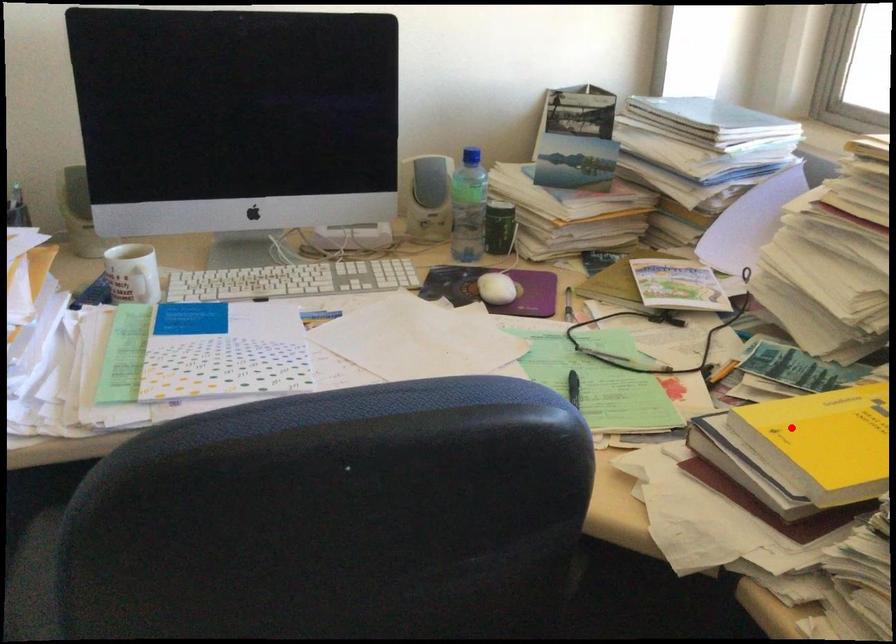
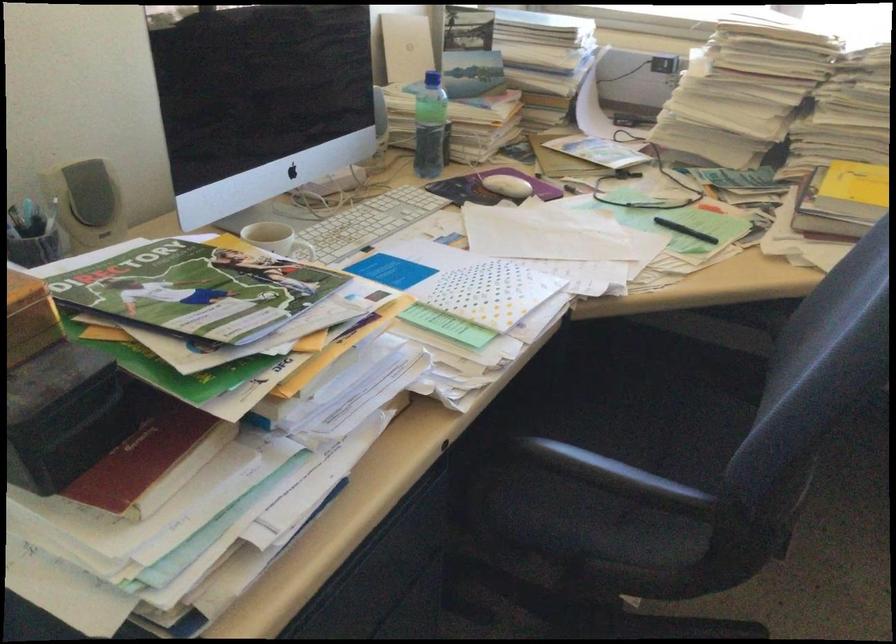
Question: I am providing you with two images of the same scene from different viewpoints. Given a red point in image1, look at the same physical point in image2. Is it:

Choices:
 (A) Closer to the viewpoint
 (B) Farther from the viewpoint

Answer: (B)